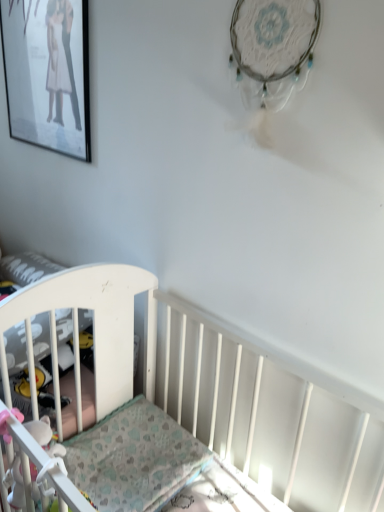
Question: From a real-world perspective, is white plastic crib at left positioned over white fabric toy at lower left based on gravity?

Choices:
 (A) yes
 (B) no

Answer: (B)

Question: Does white plastic crib at left have a lesser height compared to white fabric toy at lower left?

Choices:
 (A) no
 (B) yes

Answer: (B)

Question: Considering the relative sizes of white plastic crib at left and white fabric toy at lower left in the image provided, is white plastic crib at left thinner than white fabric toy at lower left?

Choices:
 (A) yes
 (B) no

Answer: (B)

Question: From the image's perspective, does white plastic crib at left appear higher than white fabric toy at lower left?

Choices:
 (A) no
 (B) yes

Answer: (B)

Question: Could you tell me if white plastic crib at left is turned towards white fabric toy at lower left?

Choices:
 (A) no
 (B) yes

Answer: (B)

Question: Do you think white fabric toy at lower left is within matte black picture frame at upper left, or outside of it?

Choices:
 (A) inside
 (B) outside

Answer: (B)

Question: Based on their positions, is white fabric toy at lower left located to the left or right of matte black picture frame at upper left?

Choices:
 (A) left
 (B) right

Answer: (B)

Question: In terms of size, does white fabric toy at lower left appear bigger or smaller than matte black picture frame at upper left?

Choices:
 (A) small
 (B) big

Answer: (A)

Question: Is white fabric toy at lower left taller or shorter than matte black picture frame at upper left?

Choices:
 (A) tall
 (B) short

Answer: (B)

Question: From a real-world perspective, is patterned fabric mattress at lower left positioned above or below matte black picture frame at upper left?

Choices:
 (A) above
 (B) below

Answer: (B)

Question: Looking at their shapes, would you say patterned fabric mattress at lower left is wider or thinner than matte black picture frame at upper left?

Choices:
 (A) wide
 (B) thin

Answer: (A)

Question: Is point (134, 433) closer or farther from the camera than point (44, 73)?

Choices:
 (A) closer
 (B) farther

Answer: (A)

Question: Is patterned fabric mattress at lower left inside or outside of matte black picture frame at upper left?

Choices:
 (A) outside
 (B) inside

Answer: (A)

Question: Is matte black picture frame at upper left in front of or behind white plastic crib at left in the image?

Choices:
 (A) front
 (B) behind

Answer: (B)

Question: From the image's perspective, relative to white plastic crib at left, is matte black picture frame at upper left above or below?

Choices:
 (A) above
 (B) below

Answer: (A)